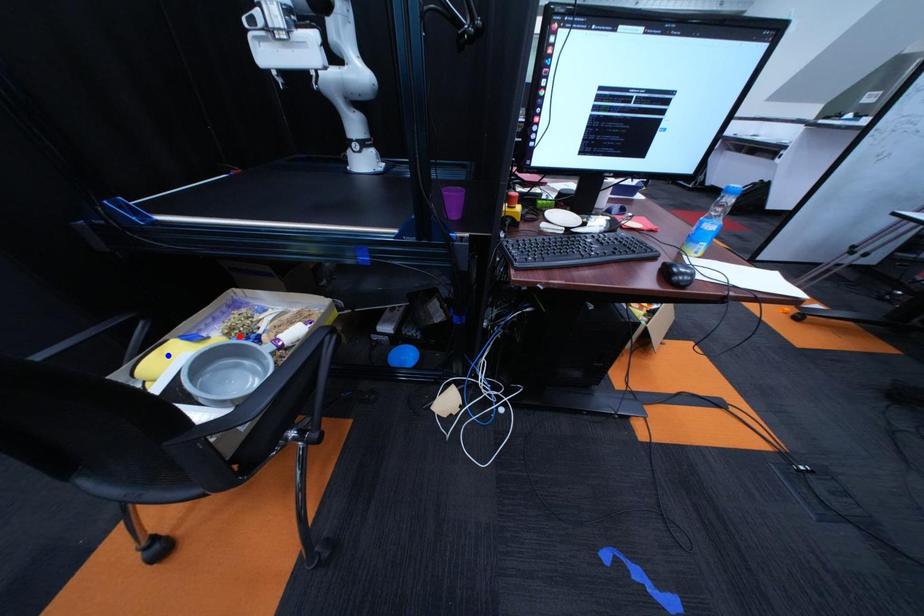
Question: Which of the two points in the image is closer to the camera?

Choices:
 (A) Blue point is closer.
 (B) Red point is closer.

Answer: (A)